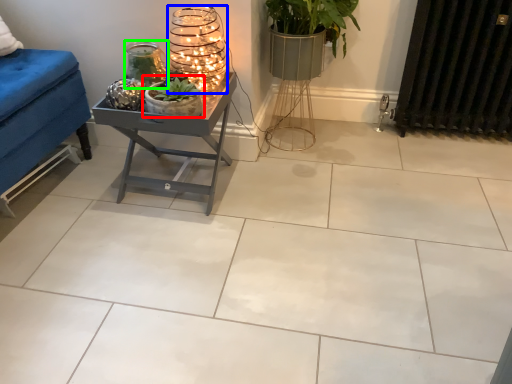
Question: Estimate the real-world distances between objects in this image. Which object is farther from houseplant (highlighted by a red box), candle holder (highlighted by a blue box) or candle holder (highlighted by a green box)?

Choices:
 (A) candle holder
 (B) candle holder

Answer: (A)